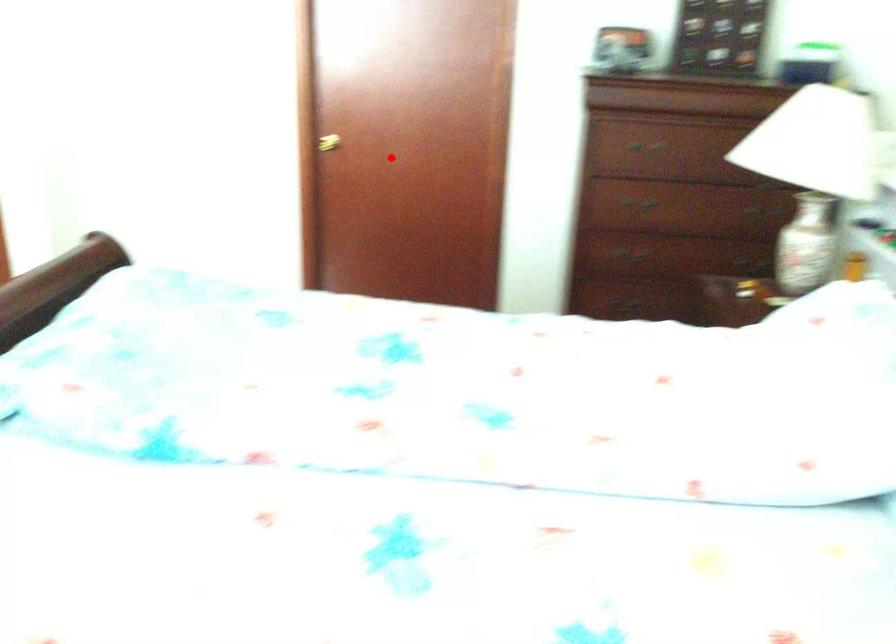
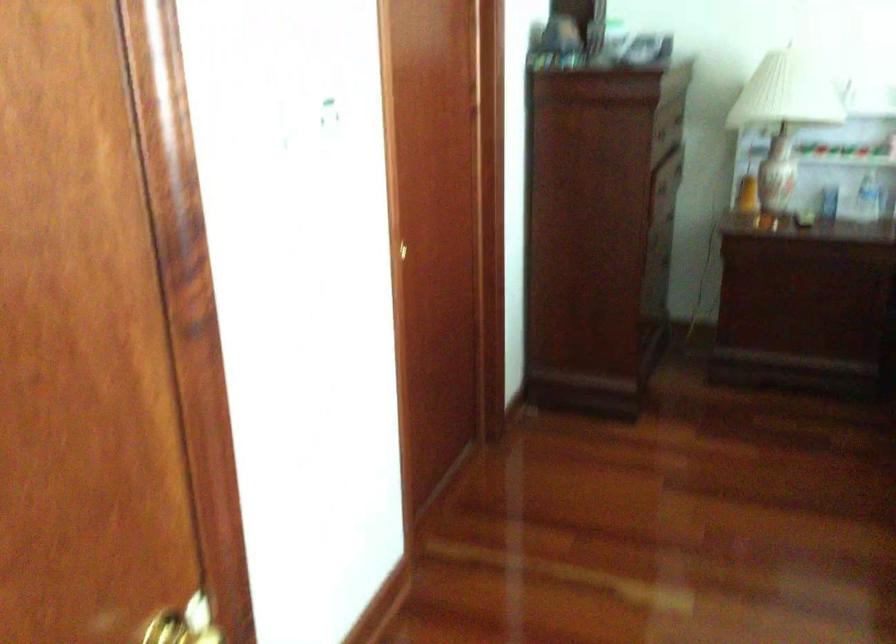
Question: A red point is marked in image1. In image2, is the corresponding 3D point closer to the camera or farther? Reply with the corresponding letter.

Choices:
 (A) The corresponding 3D point is closer.
 (B) The corresponding 3D point is farther.

Answer: (A)